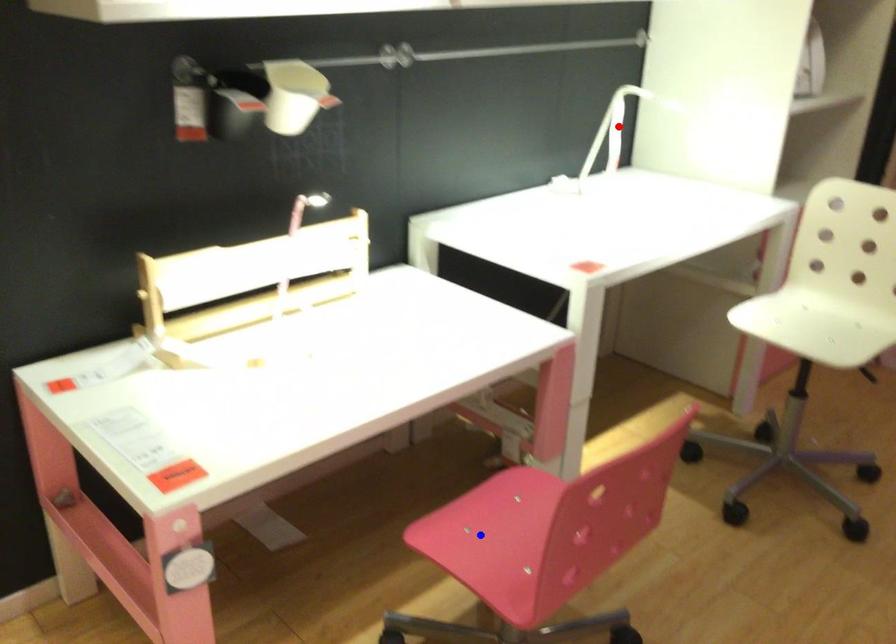
Question: In the image, two points are highlighted. Which point is nearer to the camera? Reply with the corresponding letter.

Choices:
 (A) blue point
 (B) red point

Answer: (A)